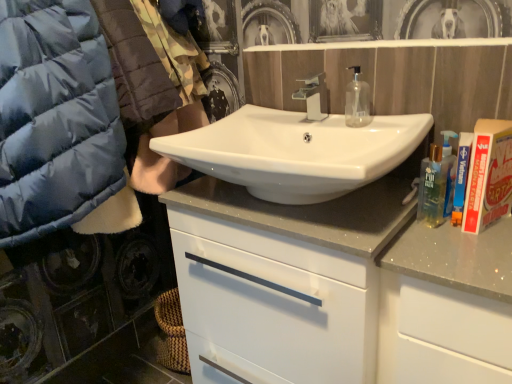
This screenshot has height=384, width=512. Identify the location of silver metallic faucet at center. (313, 96).

Locate an element on the screen. transparent plastic mouthwash at center is located at coordinates (357, 101).

What do you see at coordinates (338, 290) in the screenshot? The width and height of the screenshot is (512, 384). I see `white glossy cabinet at center` at bounding box center [338, 290].

What is the approximate width of matte blue puffer jacket at left?

24.29 inches.

Identify the location of silver metallic faucet at center. The width and height of the screenshot is (512, 384). (313, 96).

Find the location of a particular element. Image resolution: width=512 pixels, height=384 pixels. bathroom cabinet on the left of transparent plastic mouthwash at center is located at coordinates (338, 290).

Which is nearer, (279, 221) or (354, 101)?

Point (279, 221).

From the image's perspective, is white glossy cabinet at center located above transparent plastic mouthwash at center?

No, from the image's perspective, white glossy cabinet at center is not above transparent plastic mouthwash at center.

From the image's perspective, would you say white glossy sink at center is shown under silver metallic faucet at center?

Yes, from the image's perspective, white glossy sink at center is below silver metallic faucet at center.

Could you tell me if white glossy sink at center is facing silver metallic faucet at center?

No, white glossy sink at center is not aimed at silver metallic faucet at center.

Consider the image. Is white glossy sink at center smaller than silver metallic faucet at center?

Incorrect, white glossy sink at center is not smaller in size than silver metallic faucet at center.

From a real-world perspective, between white glossy sink at center and silver metallic faucet at center, who is vertically higher?

silver metallic faucet at center is physically above.

Is matte blue puffer jacket at left wider or thinner than white glossy cabinet at center?

In the image, matte blue puffer jacket at left appears to be wider than white glossy cabinet at center.

How different are the orientations of matte blue puffer jacket at left and white glossy cabinet at center in degrees?

The angular difference between matte blue puffer jacket at left and white glossy cabinet at center is 91.1 degrees.

Are matte blue puffer jacket at left and white glossy cabinet at center beside each other?

matte blue puffer jacket at left is not next to white glossy cabinet at center, and they're not touching.

Based on the photo, can you confirm if matte blue puffer jacket at left is positioned to the left of white glossy cabinet at center?

Indeed, matte blue puffer jacket at left is positioned on the left side of white glossy cabinet at center.

Considering the sizes of objects silver metallic faucet at center and matte blue puffer jacket at left in the image provided, who is shorter, silver metallic faucet at center or matte blue puffer jacket at left?

silver metallic faucet at center is shorter.

Does silver metallic faucet at center have a greater width compared to matte blue puffer jacket at left?

Incorrect, the width of silver metallic faucet at center does not surpass that of matte blue puffer jacket at left.

From a real-world perspective, is silver metallic faucet at center located beneath matte blue puffer jacket at left?

Yes, from a real-world perspective, silver metallic faucet at center is under matte blue puffer jacket at left.

This screenshot has height=384, width=512. I want to click on jacket above the silver metallic faucet at center (from a real-world perspective), so [55, 118].

Which object is wider, white glossy cabinet at center or blue plastic bottle at right?

With larger width is white glossy cabinet at center.

Considering the sizes of objects white glossy cabinet at center and blue plastic bottle at right in the image provided, who is taller, white glossy cabinet at center or blue plastic bottle at right?

white glossy cabinet at center.

Considering the relative sizes of white glossy cabinet at center and blue plastic bottle at right in the image provided, is white glossy cabinet at center bigger than blue plastic bottle at right?

Yes.

From the image's perspective, which is below, silver metallic faucet at center or blue plastic bottle at right?

blue plastic bottle at right appears lower in the image.

How much distance is there between silver metallic faucet at center and blue plastic bottle at right?

They are 16.45 inches apart.

Is silver metallic faucet at center looking in the opposite direction of blue plastic bottle at right?

No, silver metallic faucet at center is not facing the opposite direction of blue plastic bottle at right.

Does silver metallic faucet at center have a greater height compared to blue plastic bottle at right?

In fact, silver metallic faucet at center may be shorter than blue plastic bottle at right.

Image resolution: width=512 pixels, height=384 pixels. In order to click on tap that is above the matte blue puffer jacket at left (from the image's perspective) in this screenshot , I will do `click(313, 96)`.

From the image's perspective, between matte blue puffer jacket at left and silver metallic faucet at center, who is located below?

matte blue puffer jacket at left.

Consider the image. From a real-world perspective, is matte blue puffer jacket at left positioned over silver metallic faucet at center based on gravity?

Indeed, from a real-world perspective, matte blue puffer jacket at left stands above silver metallic faucet at center.

Looking at this image, can you tell me how much matte blue puffer jacket at left and silver metallic faucet at center differ in facing direction?

They differ by 91.5 degrees in their facing directions.

In order to click on bathroom cabinet that is in front of the transparent plastic mouthwash at center in this screenshot , I will do `click(338, 290)`.

This screenshot has height=384, width=512. I want to click on sink that appears below the silver metallic faucet at center (from a real-world perspective), so click(x=296, y=152).

When comparing their distances from white glossy cabinet at center, does blue plastic bottle at right or matte blue puffer jacket at left seem closer?

Based on the image, blue plastic bottle at right appears to be nearer to white glossy cabinet at center.

Looking at the image, which one is located further to white glossy cabinet at center, silver metallic faucet at center or matte blue puffer jacket at left?

Based on the image, silver metallic faucet at center appears to be further to white glossy cabinet at center.

Based on their spatial positions, is blue plastic bottle at right or matte blue puffer jacket at left further from white glossy sink at center?

Based on the image, blue plastic bottle at right appears to be further to white glossy sink at center.

Based on the photo, from the image, which object appears to be farther from transparent plastic mouthwash at center, silver metallic faucet at center or white glossy sink at center?

The object further to transparent plastic mouthwash at center is white glossy sink at center.

From the image, which object appears to be nearer to matte blue puffer jacket at left, white glossy cabinet at center or blue plastic bottle at right?

white glossy cabinet at center lies closer to matte blue puffer jacket at left than the other object.

Which object lies nearer to the anchor point transparent plastic mouthwash at center, silver metallic faucet at center or matte blue puffer jacket at left?

silver metallic faucet at center lies closer to transparent plastic mouthwash at center than the other object.

When comparing their distances from matte blue puffer jacket at left, does silver metallic faucet at center or white glossy sink at center seem further?

Based on the image, silver metallic faucet at center appears to be further to matte blue puffer jacket at left.

From the image, which object appears to be farther from matte blue puffer jacket at left, silver metallic faucet at center or blue plastic bottle at right?

blue plastic bottle at right lies further to matte blue puffer jacket at left than the other object.

The width and height of the screenshot is (512, 384). What are the coordinates of `toiletry between silver metallic faucet at center and white glossy cabinet at center from top to bottom` in the screenshot? It's located at (461, 176).

Find the location of a particular element. mouthwash positioned between white glossy sink at center and silver metallic faucet at center from near to far is located at coordinates (357, 101).

Image resolution: width=512 pixels, height=384 pixels. In order to click on sink located between matte blue puffer jacket at left and white glossy cabinet at center in the left-right direction in this screenshot , I will do `click(296, 152)`.

You are a GUI agent. You are given a task and a screenshot of the screen. Output one action in this format:
    pyautogui.click(x=<x>, y=<y>)
    Task: Click on the mouthwash between matte blue puffer jacket at left and blue plastic bottle at right in the horizontal direction
    
    Given the screenshot: What is the action you would take?
    pyautogui.click(x=357, y=101)